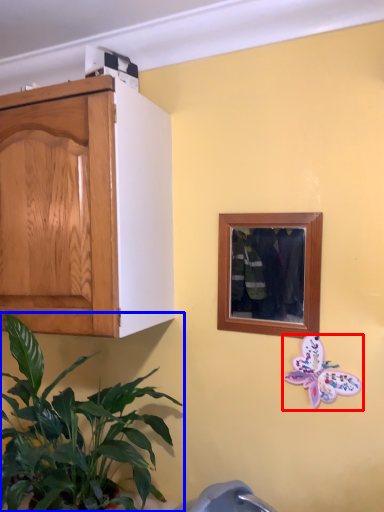
Question: Among these objects, which one is nearest to the camera, butterfly (highlighted by a red box) or houseplant (highlighted by a blue box)?

Choices:
 (A) butterfly
 (B) houseplant

Answer: (B)